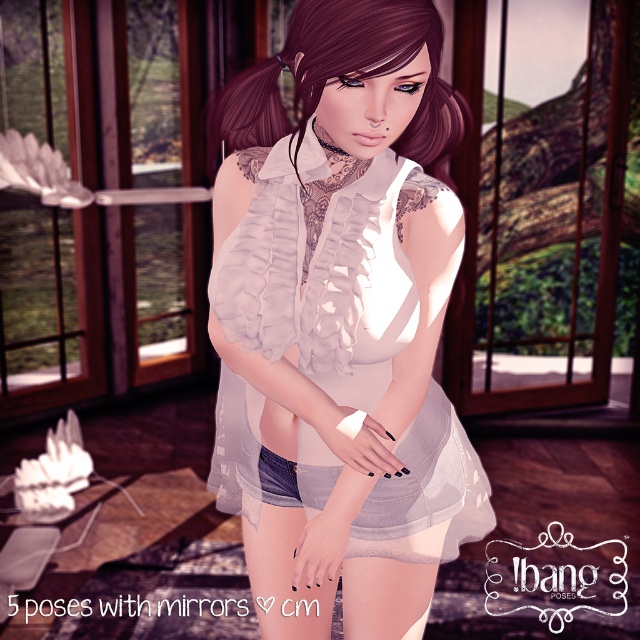
You are a fashion designer trying to decide which blouse to feature in your new collection. You have two options in front of you, the white sheer blouse at center and the matte white blouse at center. Based on their sizes, which one would you choose if you want the blouse to cover more of the upper body?

The white sheer blouse at center is bigger than the matte white blouse at center, so it would cover more of the upper body and is the better choice.

You are an interior designer who needs to place a new lamp in the room. The lamp must be placed at coordinates exactly 0.5, 0.5. Will the lamp interfere with the white sheer blouse at center?

The white sheer blouse at center is located at point (339, 317), which is very close to the desired coordinates of (320, 320). The lamp placement may interfere with the blouse depending on the lamp size and exact positioning.

You are an interior designer observing the character in the scene. You need to determine the correct order of the white sheer blouse at center and the matte white blouse at center from top to bottom. Which one is positioned higher?

The matte white blouse at center is positioned higher than the white sheer blouse at center since the sheer blouse is located below it.